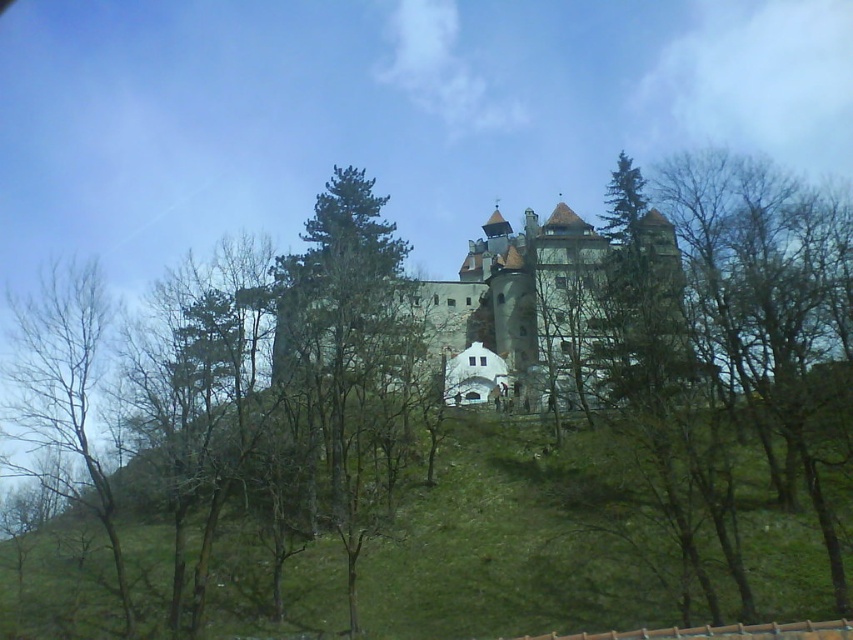
Question: Which of the following is the farthest from the observer?

Choices:
 (A) brown stone castle at center
 (B) bare branches at left

Answer: (A)

Question: Observing the image, what is the correct spatial positioning of brown stone castle at center in reference to bare branches at left?

Choices:
 (A) below
 (B) above

Answer: (B)

Question: Which point appears closest to the camera in this image?

Choices:
 (A) (577, 236)
 (B) (67, 266)

Answer: (B)

Question: Is brown stone castle at center positioned behind bare branches at left?

Choices:
 (A) yes
 (B) no

Answer: (A)

Question: Can you confirm if brown stone castle at center is positioned above bare branches at left?

Choices:
 (A) yes
 (B) no

Answer: (A)